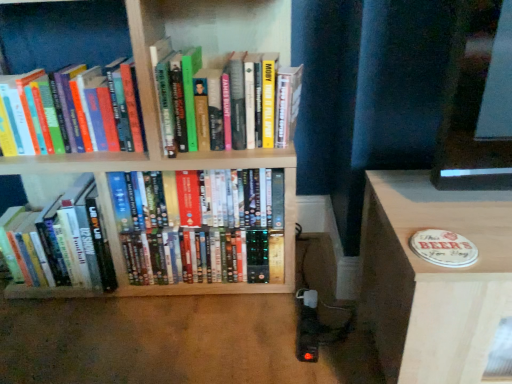
Question: Does hardcover book at upper left, the third book in the right-to-left sequence, have a greater height compared to wooden coaster at lower right?

Choices:
 (A) no
 (B) yes

Answer: (A)

Question: From the image's perspective, is hardcover book at upper left, the second book positioned from the left, located above wooden coaster at lower right?

Choices:
 (A) yes
 (B) no

Answer: (A)

Question: Is hardcover book at upper left, the second book positioned from the left, oriented away from wooden coaster at lower right?

Choices:
 (A) yes
 (B) no

Answer: (B)

Question: From a real-world perspective, is hardcover book at upper left, the third book in the right-to-left sequence, over wooden coaster at lower right?

Choices:
 (A) yes
 (B) no

Answer: (A)

Question: Can you confirm if hardcover book at upper left, the second book positioned from the left, is positioned to the right of wooden coaster at lower right?

Choices:
 (A) yes
 (B) no

Answer: (B)

Question: Would you consider hardcover book at upper left, the second book positioned from the left, to be distant from wooden coaster at lower right?

Choices:
 (A) yes
 (B) no

Answer: (B)

Question: Considering the relative positions of hardcover books at left, the first book viewed from the left, and hardcover books at center, arranged as the 3th book when viewed from the left, in the image provided, is hardcover books at left, the first book viewed from the left, to the left of hardcover books at center, arranged as the 3th book when viewed from the left, from the viewer's perspective?

Choices:
 (A) no
 (B) yes

Answer: (B)

Question: Does hardcover books at left, acting as the 4th book starting from the right, have a greater height compared to hardcover books at center, the 2th book in the right-to-left sequence?

Choices:
 (A) yes
 (B) no

Answer: (B)

Question: Can you confirm if hardcover books at left, acting as the 4th book starting from the right, is shorter than hardcover books at center, arranged as the 3th book when viewed from the left?

Choices:
 (A) yes
 (B) no

Answer: (A)

Question: From a real-world perspective, is hardcover books at left, acting as the 4th book starting from the right, over hardcover books at center, the 2th book in the right-to-left sequence?

Choices:
 (A) yes
 (B) no

Answer: (B)

Question: Can you confirm if hardcover books at left, acting as the 4th book starting from the right, is bigger than hardcover books at center, the 2th book in the right-to-left sequence?

Choices:
 (A) yes
 (B) no

Answer: (B)

Question: Is hardcover books at left, acting as the 4th book starting from the right, not near hardcover books at center, the 2th book in the right-to-left sequence?

Choices:
 (A) no
 (B) yes

Answer: (A)

Question: From the image's perspective, does hardcover book at upper left, the third book in the right-to-left sequence, appear lower than wooden bookshelf at center?

Choices:
 (A) yes
 (B) no

Answer: (B)